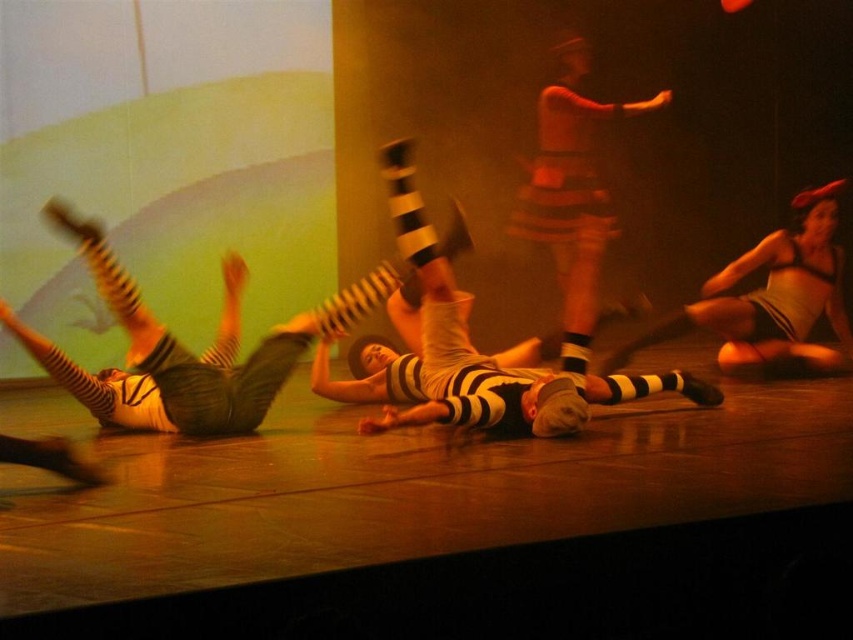
Who is shorter, white striped socks at center or matte white swimsuit at right?

matte white swimsuit at right

Between point (389, 204) and point (801, 224), which one is positioned in front?

Point (801, 224) is in front.

Between point (370, 275) and point (785, 237), which one is positioned in front?

Positioned in front is point (370, 275).

Identify the location of white striped socks at center. The image size is (853, 640). (490, 358).

Can you confirm if striped fabric dancer at center is wider than matte white swimsuit at right?

Incorrect, striped fabric dancer at center's width does not surpass matte white swimsuit at right's.

Which of these two, striped fabric dancer at center or matte white swimsuit at right, stands shorter?

Standing shorter between the two is striped fabric dancer at center.

Image resolution: width=853 pixels, height=640 pixels. Identify the location of striped fabric dancer at center. (170, 353).

Locate an element on the screen. Image resolution: width=853 pixels, height=640 pixels. white striped socks at center is located at coordinates (490, 358).

Is white striped socks at center in front of striped fabric dancer at center?

No, it is not.

Identify the location of white striped socks at center. point(490,358).

Find the location of `white striped socks at center`. white striped socks at center is located at coordinates (490, 358).